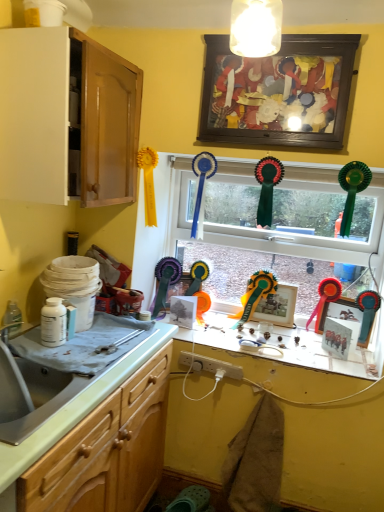
The height and width of the screenshot is (512, 384). What are the coordinates of `vacant area that is in front of metallic gold picture frame at center, the fourth picture frame positioned from the bottom` in the screenshot? It's located at (268, 338).